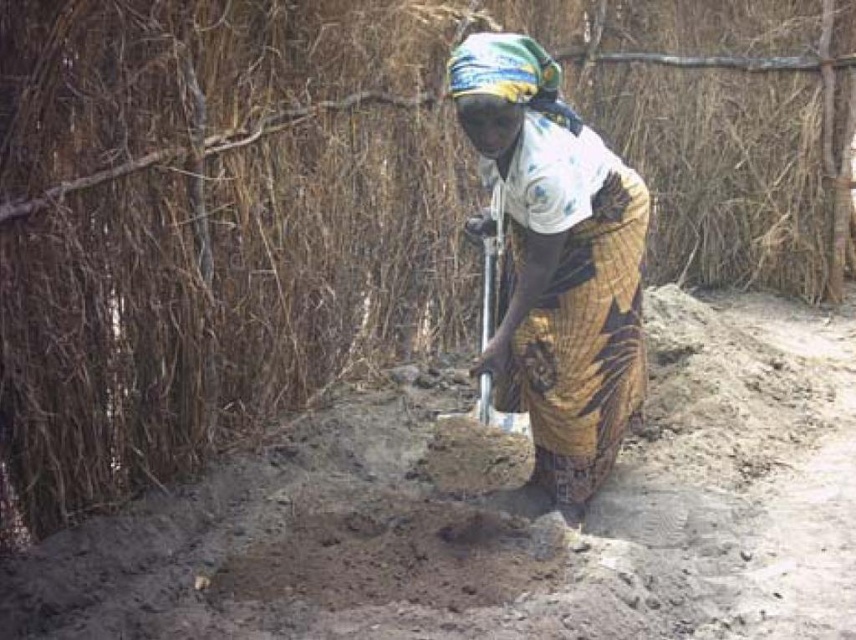
Is printed cotton dress at center below metallic silver shovel at center?

No.

Which is in front, point (648, 208) or point (474, 456)?

Point (648, 208) is in front.

At what (x,y) coordinates should I click in order to perform the action: click on printed cotton dress at center. Please return your answer as a coordinate pair (x, y). Image resolution: width=856 pixels, height=640 pixels. Looking at the image, I should click on (557, 268).